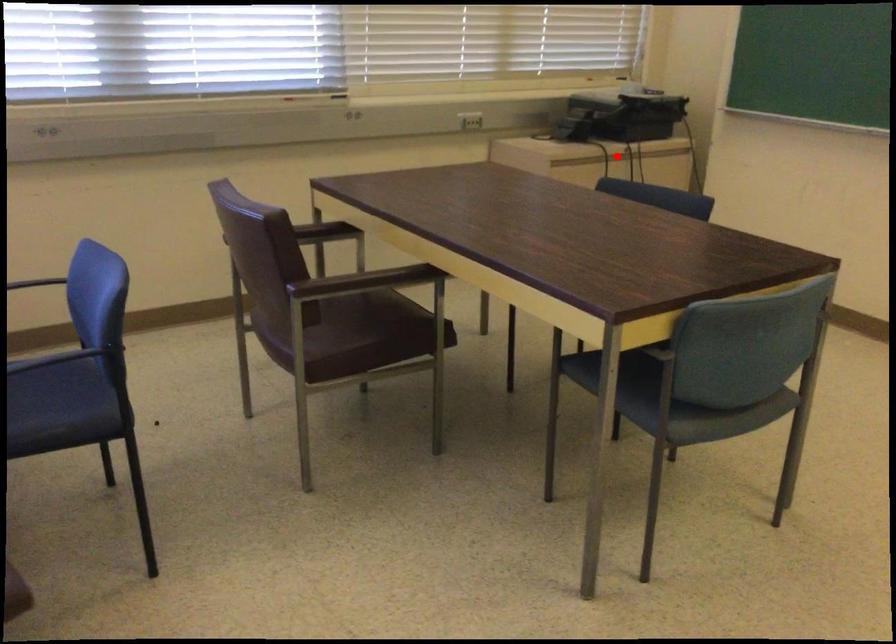
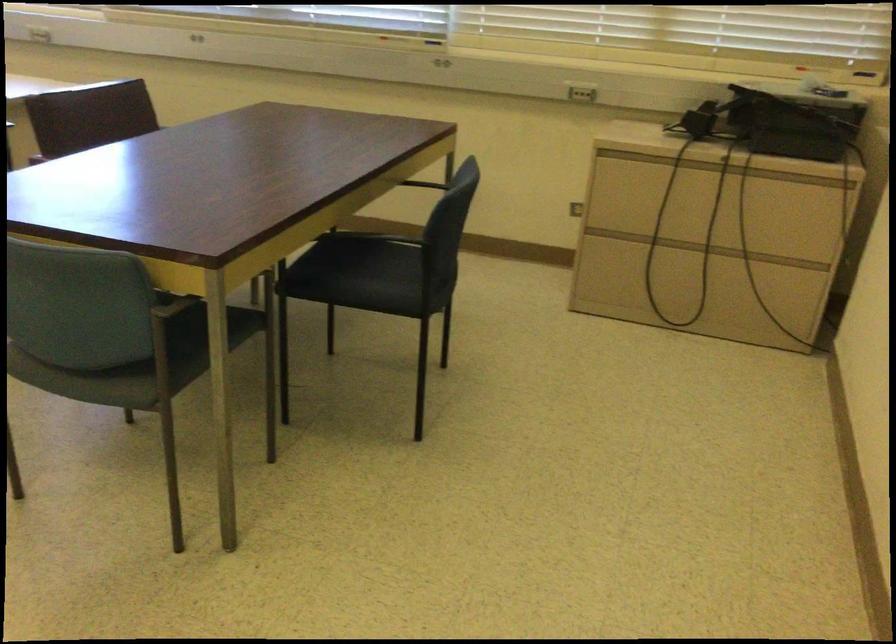
Where in the second image is the point corresponding to the highlighted location from the first image?

(700, 167)